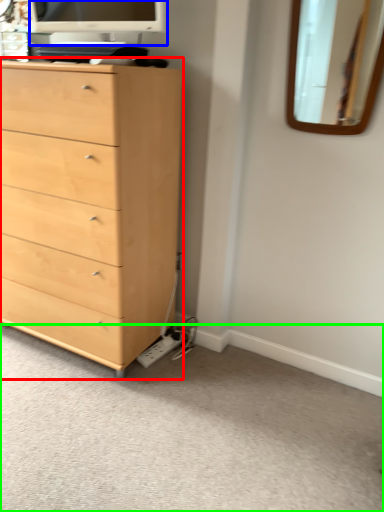
Question: Which object is positioned closest to chest of drawers (highlighted by a red box)? Select from computer monitor (highlighted by a blue box) and plain (highlighted by a green box).

Choices:
 (A) computer monitor
 (B) plain

Answer: (B)